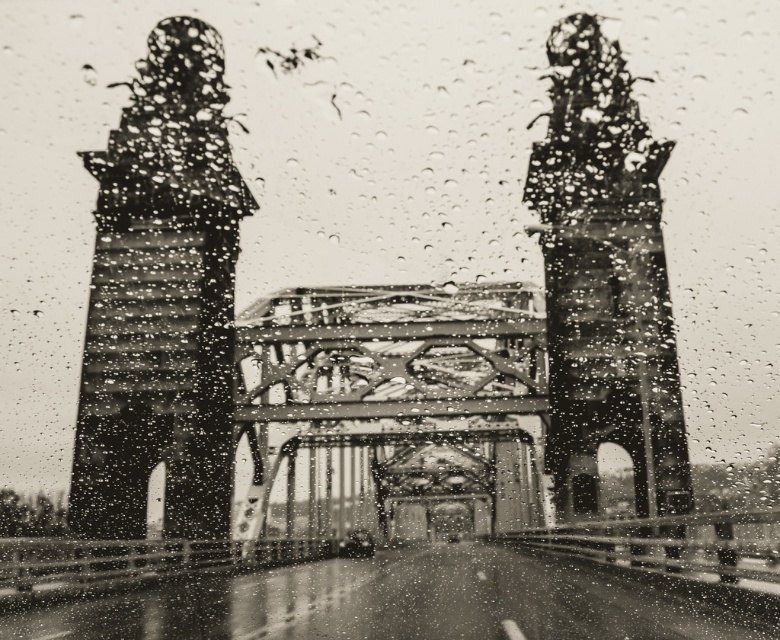
Question: Is rusty metal tower at left above rusty metal bell tower at center?

Choices:
 (A) yes
 (B) no

Answer: (A)

Question: Which point is closer to the camera?

Choices:
 (A) rusty metal tower at left
 (B) rusty metal bell tower at center

Answer: (B)

Question: Does rusty metal tower at left lie in front of rusty metal bell tower at center?

Choices:
 (A) yes
 (B) no

Answer: (B)

Question: Is rusty metal tower at left to the left of rusty metal bell tower at center from the viewer's perspective?

Choices:
 (A) yes
 (B) no

Answer: (A)

Question: Among these points, which one is farthest from the camera?

Choices:
 (A) (633, 236)
 (B) (541, 500)

Answer: (B)

Question: Which object is positioned closest to the metallic bridge at center?

Choices:
 (A) rusty metal tower at left
 (B) rusty metal bell tower at center

Answer: (A)